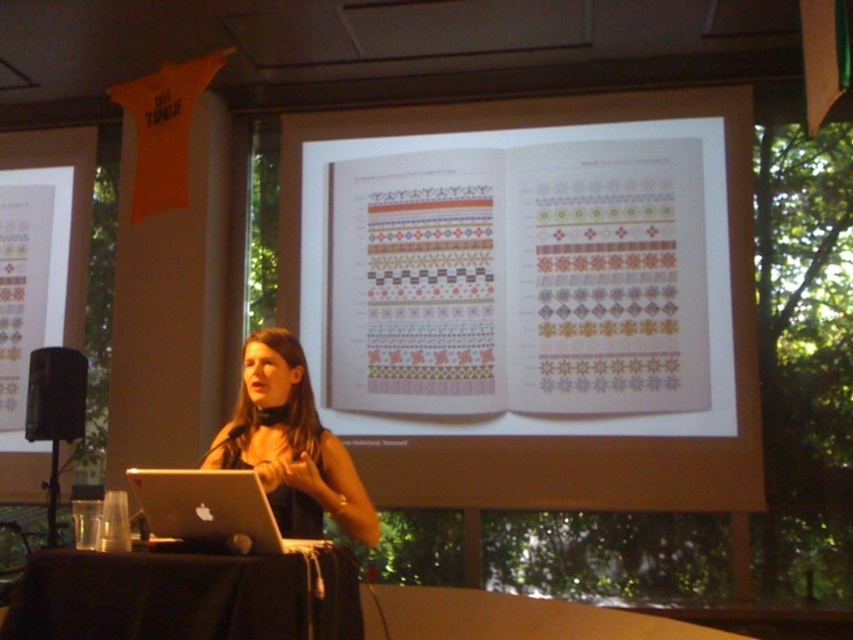
Can you confirm if white paper at center is bigger than silver metallic laptop at lower left?

Yes.

Between white paper at center and silver metallic laptop at lower left, which one has more height?

With more height is white paper at center.

The height and width of the screenshot is (640, 853). Describe the element at coordinates (556, 435) in the screenshot. I see `white paper at center` at that location.

Where is `white paper at center`? white paper at center is located at coordinates (556, 435).

Is point (32, 604) closer to viewer compared to point (305, 362)?

Yes, point (32, 604) is in front of point (305, 362).

Can you confirm if black fabric table at lower center is positioned below black matte laptop at center?

Yes, black fabric table at lower center is below black matte laptop at center.

Is point (119, 579) positioned before point (328, 468)?

Yes.

Image resolution: width=853 pixels, height=640 pixels. In order to click on black fabric table at lower center in this screenshot , I will do `click(184, 596)`.

Find the location of `white paper at center`. white paper at center is located at coordinates (556, 435).

Is white paper at center to the left of black fabric table at lower center from the viewer's perspective?

In fact, white paper at center is to the right of black fabric table at lower center.

Measure the distance between white paper at center and camera.

white paper at center is 3.91 meters from camera.

This screenshot has height=640, width=853. In order to click on white paper at center in this screenshot , I will do `click(556, 435)`.